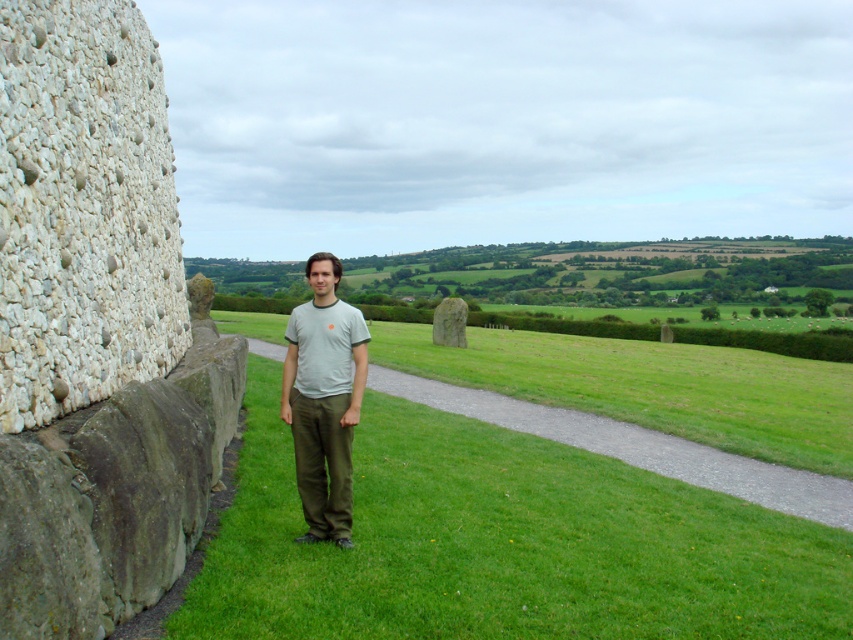
Is point (482, 333) positioned in front of point (289, 342)?

No, (482, 333) is behind (289, 342).

Can you confirm if green grass at center is thinner than gray cotton t-shirt at center?

No, green grass at center is not thinner than gray cotton t-shirt at center.

Where is `green grass at center`? green grass at center is located at coordinates (653, 403).

Where is `green grass at center`? green grass at center is located at coordinates (653, 403).